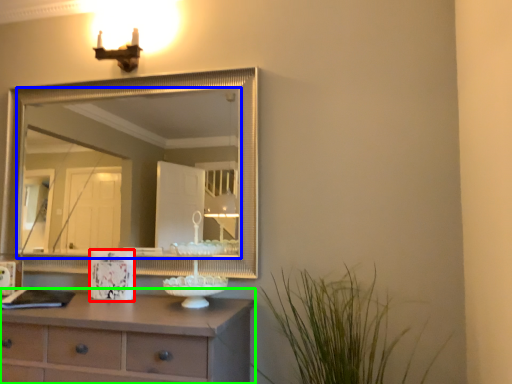
Question: Which object is positioned closest to picture frame (highlighted by a red box)? Select from mirror (highlighted by a blue box) and chest of drawers (highlighted by a green box).

Choices:
 (A) mirror
 (B) chest of drawers

Answer: (B)